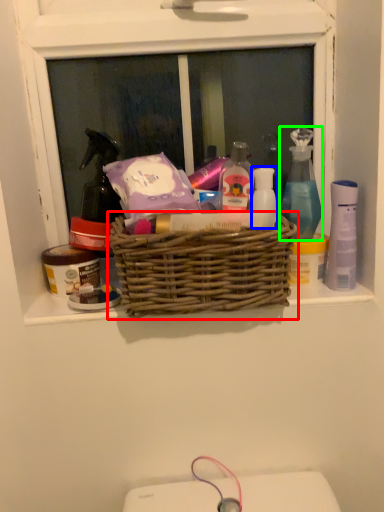
Question: Which is nearer to the picnic basket (highlighted by a red box)? toiletry (highlighted by a blue box) or cleaning product (highlighted by a green box).

Choices:
 (A) toiletry
 (B) cleaning product

Answer: (A)